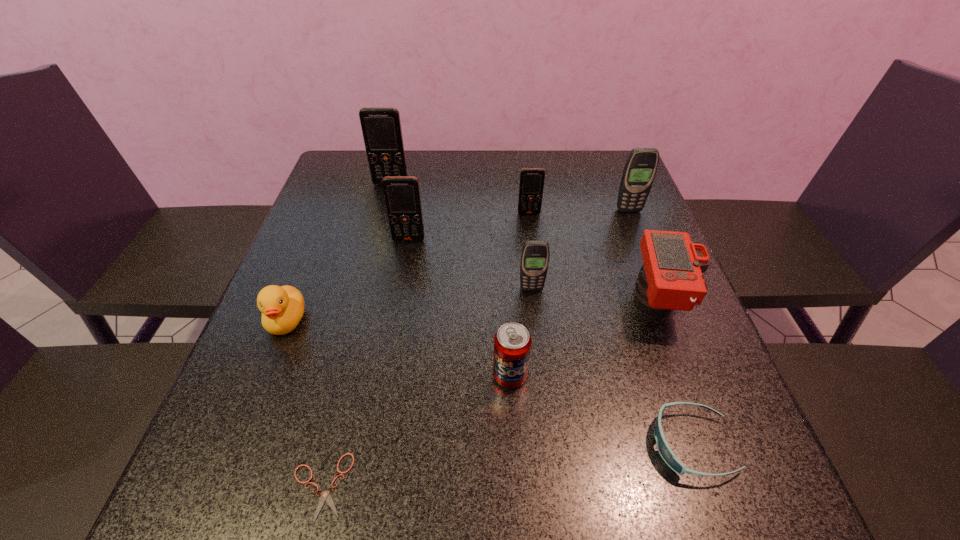
This screenshot has width=960, height=540. Find the location of `object that is positioned at the near right corner`. object that is positioned at the near right corner is located at coordinates 668,456.

At what (x,y) coordinates should I click in order to perform the action: click on free region at the far edge of the desktop. Please return your answer as a coordinate pair (x, y). This screenshot has height=540, width=960. Looking at the image, I should click on (549, 157).

The image size is (960, 540). What are the coordinates of `vacant space at the left edge of the desktop` in the screenshot? It's located at (335, 237).

In the image, there is a desktop. Identify the location of vacant region at the right edge. Image resolution: width=960 pixels, height=540 pixels. (629, 323).

In the image, there is a desktop. At what (x,y) coordinates should I click in order to perform the action: click on vacant space at the far left corner. Please return your answer as a coordinate pair (x, y). The image size is (960, 540). Looking at the image, I should click on (338, 194).

The image size is (960, 540). I want to click on vacant space at the far right corner of the desktop, so click(594, 154).

You are a GUI agent. You are given a task and a screenshot of the screen. Output one action in this format:
    pyautogui.click(x=<x>, y=<y>)
    Task: Click on the free location at the near right corner
    This screenshot has width=960, height=540.
    Given the screenshot: What is the action you would take?
    pyautogui.click(x=776, y=506)

Identify the location of vacant space in between the duck and the shears. Image resolution: width=960 pixels, height=540 pixels. (303, 403).

Where is `free point between the third shortest object and the ninth tallest object`? The height and width of the screenshot is (540, 960). free point between the third shortest object and the ninth tallest object is located at coordinates (489, 382).

Where is `free area in between the ninth tallest object and the right gray cellular telephone`? The height and width of the screenshot is (540, 960). free area in between the ninth tallest object and the right gray cellular telephone is located at coordinates (660, 327).